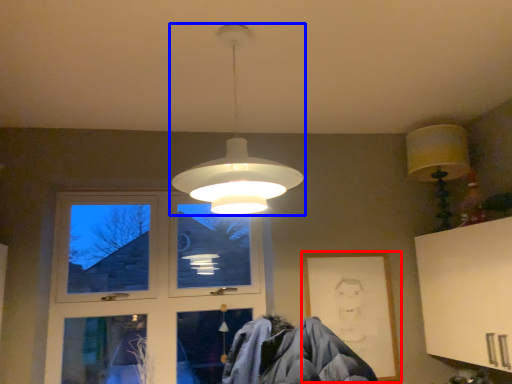
Question: Among these objects, which one is nearest to the camera, picture frame (highlighted by a red box) or lamp (highlighted by a blue box)?

Choices:
 (A) picture frame
 (B) lamp

Answer: (B)